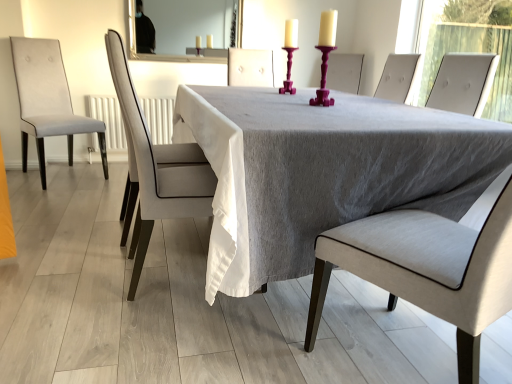
Question: Is light gray fabric chair at center, acting as the 2th chair starting from the left, wider than light gray fabric chair at left, acting as the third chair starting from the front?

Choices:
 (A) no
 (B) yes

Answer: (A)

Question: Is light gray fabric chair at center, which is counted as the second chair, starting from the right, oriented away from light gray fabric chair at left, positioned as the first chair in left-to-right order?

Choices:
 (A) yes
 (B) no

Answer: (B)

Question: Considering the relative positions of light gray fabric chair at center, acting as the 2th chair starting from the left, and light gray fabric chair at left, positioned as the first chair in left-to-right order, in the image provided, is light gray fabric chair at center, acting as the 2th chair starting from the left, to the left of light gray fabric chair at left, positioned as the first chair in left-to-right order, from the viewer's perspective?

Choices:
 (A) no
 (B) yes

Answer: (A)

Question: Is light gray fabric chair at left, positioned as the first chair in left-to-right order, completely or partially inside light gray fabric chair at center, which is counted as the second chair, starting from the right?

Choices:
 (A) yes
 (B) no

Answer: (B)

Question: Considering the relative positions of light gray fabric chair at center, acting as the 2th chair starting from the left, and light gray fabric chair at left, acting as the third chair starting from the front, in the image provided, is light gray fabric chair at center, acting as the 2th chair starting from the left, behind light gray fabric chair at left, acting as the third chair starting from the front,?

Choices:
 (A) no
 (B) yes

Answer: (A)

Question: From a real-world perspective, does light gray fabric chair at center, which is counted as the second chair, starting from the right, stand above light gray fabric chair at left, acting as the third chair starting from the front?

Choices:
 (A) yes
 (B) no

Answer: (A)

Question: Would you say purple plastic candle holder at center, the first candle holder in the front-to-back sequence, is outside purple glossy candle holder at center, marked as the 2th candle holder in a front-to-back arrangement?

Choices:
 (A) yes
 (B) no

Answer: (A)

Question: Would you say purple plastic candle holder at center, the first candle holder in the front-to-back sequence, contains purple glossy candle holder at center, the 1th candle holder positioned from the back?

Choices:
 (A) no
 (B) yes

Answer: (A)

Question: Is purple plastic candle holder at center, which is the second candle holder in back-to-front order, positioned behind purple glossy candle holder at center, marked as the 2th candle holder in a front-to-back arrangement?

Choices:
 (A) no
 (B) yes

Answer: (A)

Question: Considering the relative sizes of purple plastic candle holder at center, the first candle holder in the front-to-back sequence, and purple glossy candle holder at center, the 1th candle holder positioned from the back, in the image provided, is purple plastic candle holder at center, the first candle holder in the front-to-back sequence, wider than purple glossy candle holder at center, the 1th candle holder positioned from the back,?

Choices:
 (A) no
 (B) yes

Answer: (B)

Question: From the image's perspective, is purple plastic candle holder at center, which is the second candle holder in back-to-front order, under purple glossy candle holder at center, the 1th candle holder positioned from the back?

Choices:
 (A) no
 (B) yes

Answer: (B)

Question: Can you confirm if purple plastic candle holder at center, which is the second candle holder in back-to-front order, is smaller than purple glossy candle holder at center, marked as the 2th candle holder in a front-to-back arrangement?

Choices:
 (A) no
 (B) yes

Answer: (A)

Question: Is gray fabric table at center completely or partially outside of white glossy mirror at upper center?

Choices:
 (A) yes
 (B) no

Answer: (A)